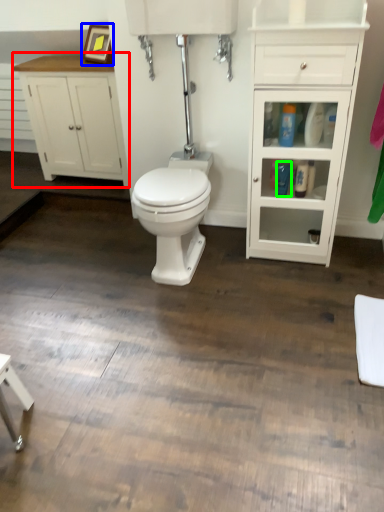
Question: Considering the real-world distances, which object is farthest from bathroom cabinet (highlighted by a red box)? picture frame (highlighted by a blue box) or toiletry (highlighted by a green box)?

Choices:
 (A) picture frame
 (B) toiletry

Answer: (B)